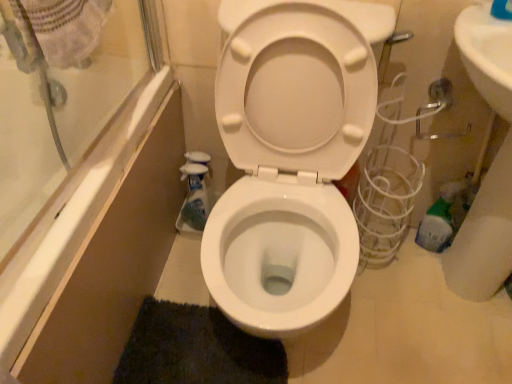
Locate an element on the screen. Image resolution: width=512 pixels, height=384 pixels. dark green textured bath mat at lower center is located at coordinates [196, 349].

Describe the element at coordinates (196, 349) in the screenshot. I see `dark green textured bath mat at lower center` at that location.

Locate an element on the screen. The image size is (512, 384). dark green textured bath mat at lower center is located at coordinates (196, 349).